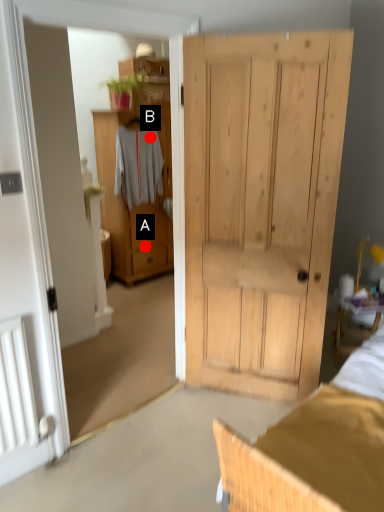
Question: Two points are circled on the image, labeled by A and B beside each circle. Which of the following is the farthest from the observer?

Choices:
 (A) A is further
 (B) B is further

Answer: (A)